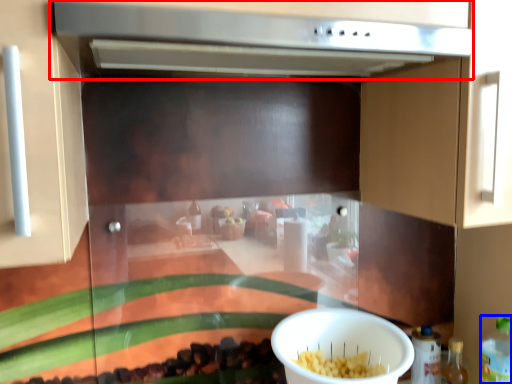
Question: Which of the following is the farthest to the observer, vent (highlighted by a red box) or bottle (highlighted by a blue box)?

Choices:
 (A) vent
 (B) bottle

Answer: (B)